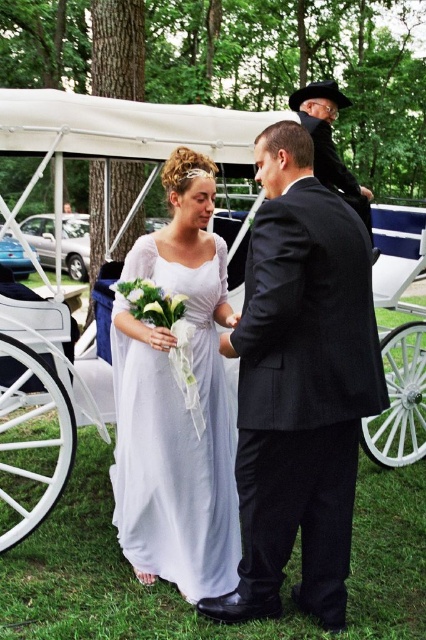
You are a photographer at a wedding, and you need to position yourself between the white fabric coach at center and the black leather coach at upper center. Which coach should you stand closer to if you want to capture both coaches in your shot without moving your camera position?

The white fabric coach at center is positioned on the left side of the black leather coach at upper center, so standing closer to the white fabric coach at center will allow you to capture both coaches in the frame without moving the camera.

You are a photographer at the wedding and need to position a spotlight exactly at the point marked as point (175, 436). What object in the scene is located at that point?

The point (175, 436) corresponds to the white chiffon dress at center.